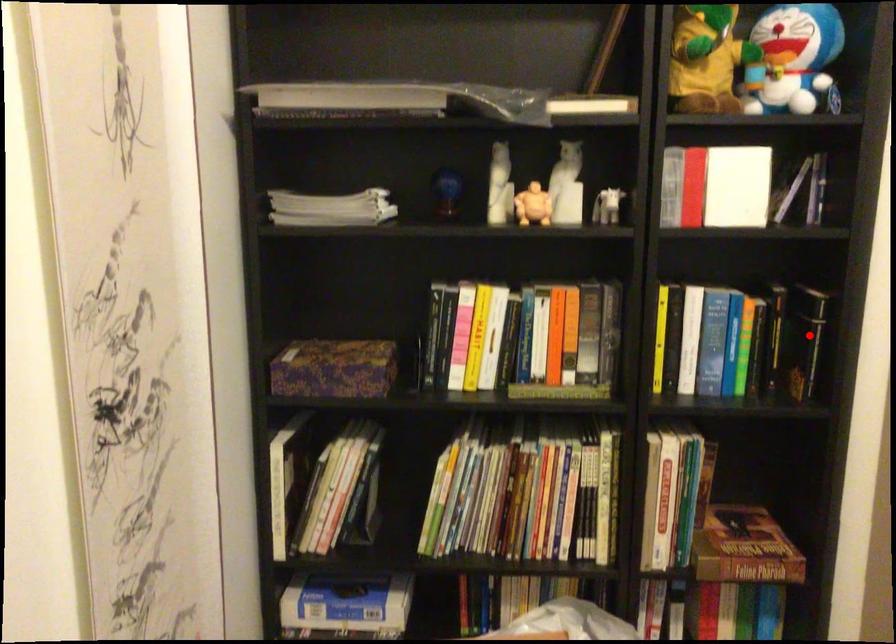
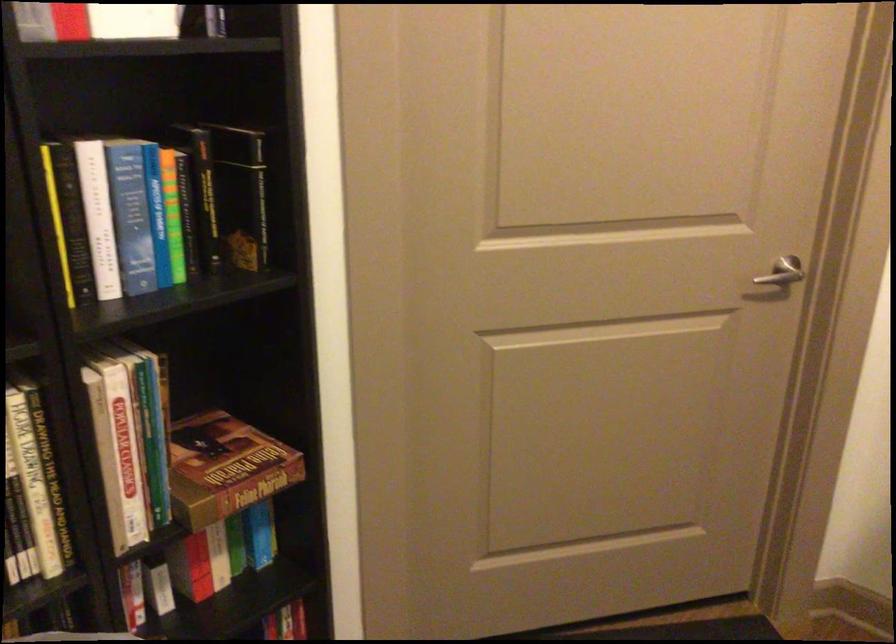
Question: I am providing you with two images of the same scene from different viewpoints. Image1 has a red point marked. In image2, the corresponding 3D location appears at what relative position? Reply with the corresponding letter.

Choices:
 (A) Closer
 (B) Farther

Answer: (A)